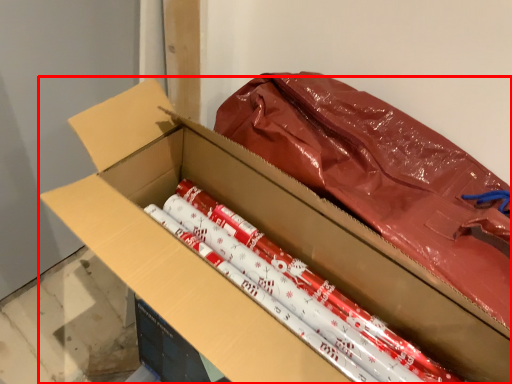
Question: From the image's perspective, what is the correct spatial positioning of box (annotated by the red box) in reference to crayon?

Choices:
 (A) below
 (B) above

Answer: (A)